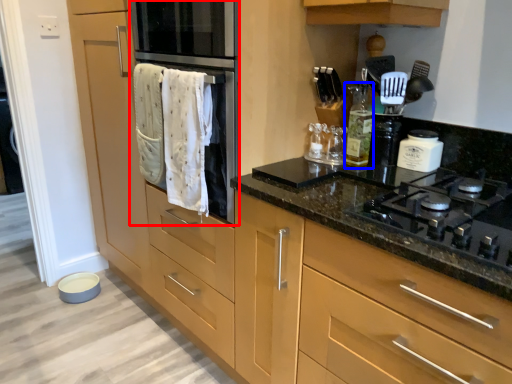
Question: Which of the following is the farthest to the observer, oven (highlighted by a red box) or bottle (highlighted by a blue box)?

Choices:
 (A) oven
 (B) bottle

Answer: (B)